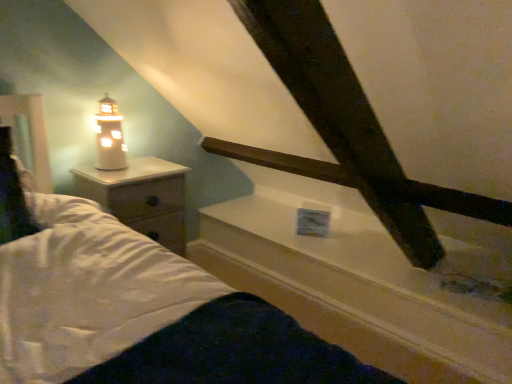
The image size is (512, 384). Identify the location of empty space that is ontop of white wood nightstand at left (from a real-world perspective). (133, 172).